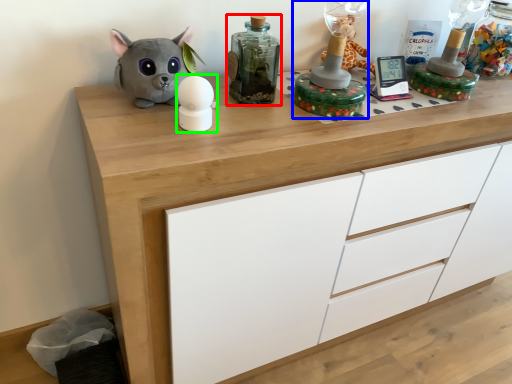
Question: Which object is the farthest from bottle (highlighted by a red box)? Choose among these: toy (highlighted by a blue box) or toy (highlighted by a green box).

Choices:
 (A) toy
 (B) toy

Answer: (B)